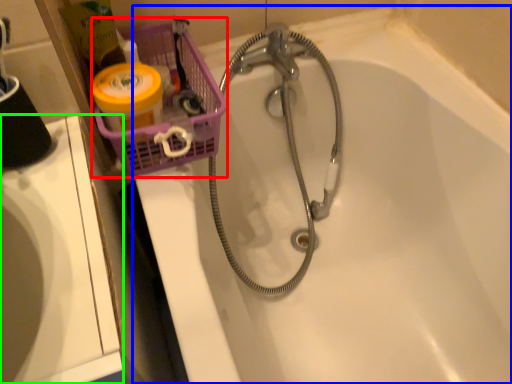
Question: Considering the real-world distances, which object is farthest from basket (highlighted by a red box)? bathtub (highlighted by a blue box) or sink (highlighted by a green box)?

Choices:
 (A) bathtub
 (B) sink

Answer: (A)